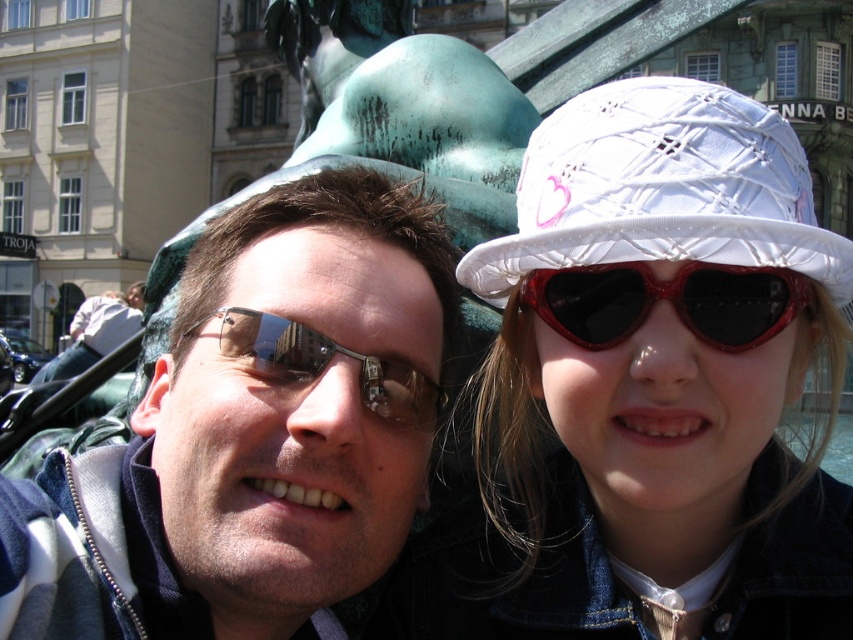
Which of these two, red shiny heart-shaped sunglasses at upper right or metallic reflective sunglasses at center, stands shorter?

red shiny heart-shaped sunglasses at upper right

Is the position of red shiny heart-shaped sunglasses at upper right less distant than that of metallic reflective sunglasses at center?

Yes, red shiny heart-shaped sunglasses at upper right is closer to the viewer.

Does point (712, 333) come behind point (358, 396)?

That is False.

Locate an element on the screen. This screenshot has width=853, height=640. red shiny heart-shaped sunglasses at upper right is located at coordinates (666, 300).

Does white quilted hat at upper right have a greater width compared to metallic reflective sunglasses at center?

Yes, white quilted hat at upper right is wider than metallic reflective sunglasses at center.

Who is more forward, (628, 259) or (224, 332)?

Positioned in front is point (628, 259).

Find the location of `white quilted hat at upper right`. white quilted hat at upper right is located at coordinates (648, 388).

Does white quilted hat at upper right lie in front of red shiny heart-shaped sunglasses at upper right?

Yes, it is in front of red shiny heart-shaped sunglasses at upper right.

Does white quilted hat at upper right have a smaller size compared to red shiny heart-shaped sunglasses at upper right?

No, white quilted hat at upper right is not smaller than red shiny heart-shaped sunglasses at upper right.

Between point (833, 548) and point (717, 326), which one is positioned behind?

The point (833, 548) is behind.

Where is `white quilted hat at upper right`? white quilted hat at upper right is located at coordinates (648, 388).